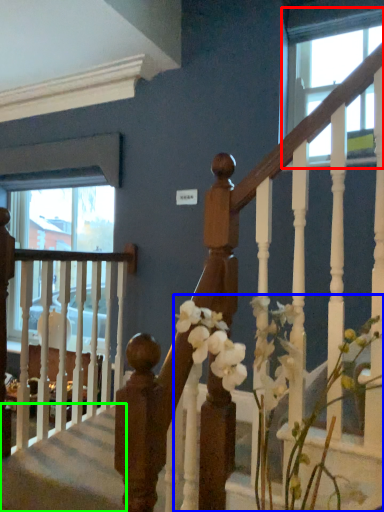
Question: Based on their relative distances, which object is nearer to window (highlighted by a red box)? Choose from floral arrangement (highlighted by a blue box) and stairwell (highlighted by a green box).

Choices:
 (A) floral arrangement
 (B) stairwell

Answer: (A)